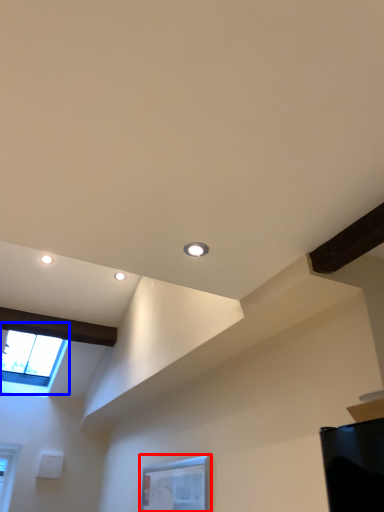
Question: Which point is further to the camera, window (highlighted by a red box) or window (highlighted by a blue box)?

Choices:
 (A) window
 (B) window

Answer: (B)